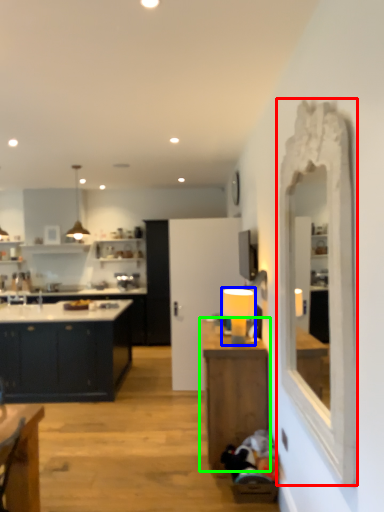
Question: Based on their relative distances, which object is farther from mirror (highlighted by a red box)? Choose from lamp (highlighted by a blue box) and table (highlighted by a green box).

Choices:
 (A) lamp
 (B) table

Answer: (A)